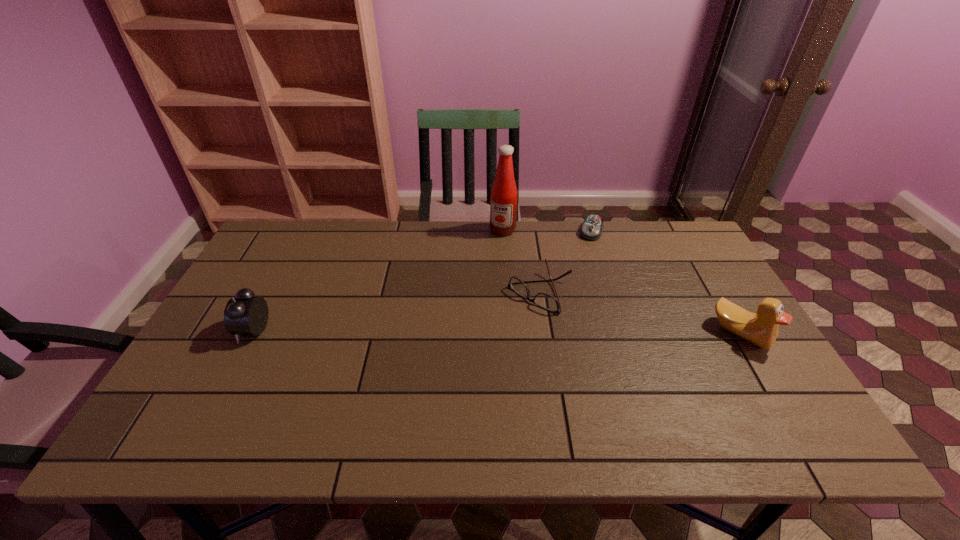
This screenshot has width=960, height=540. In order to click on object located at the right edge in this screenshot , I will do `click(761, 328)`.

Locate an element on the screen. vacant area at the far edge is located at coordinates (558, 224).

Identify the location of free spot at the near edge of the desktop. (481, 377).

This screenshot has width=960, height=540. In the image, there is a desktop. In order to click on vacant space at the left edge in this screenshot , I will do `click(224, 364)`.

Where is `blank space at the right edge of the desktop`? blank space at the right edge of the desktop is located at coordinates (713, 277).

In the image, there is a desktop. Find the location of `vacant space at the far left corner`. vacant space at the far left corner is located at coordinates (266, 245).

Identify the location of vacant space at the near left corner of the desktop. This screenshot has width=960, height=540. (221, 403).

The height and width of the screenshot is (540, 960). In the image, there is a desktop. Identify the location of vacant space at the near right corner. (728, 383).

Locate an element on the screen. Image resolution: width=960 pixels, height=540 pixels. free space between the condiment and the alarm clock is located at coordinates (378, 280).

Identify the location of vacant point located between the alarm clock and the computer mouse. (422, 280).